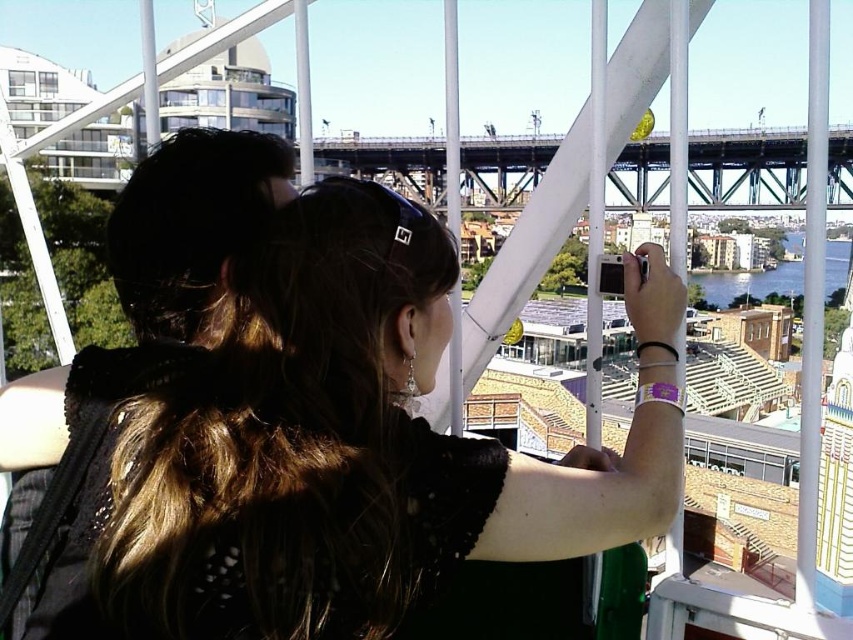
Is point (183, 374) positioned before point (752, 168)?

Yes, point (183, 374) is in front of point (752, 168).

Who is shorter, black lace dress at center or metallic gray bridge at center?

With less height is metallic gray bridge at center.

Does point (664, 470) lie behind point (614, 209)?

No, it is in front of (614, 209).

Locate an element on the screen. black lace dress at center is located at coordinates (346, 445).